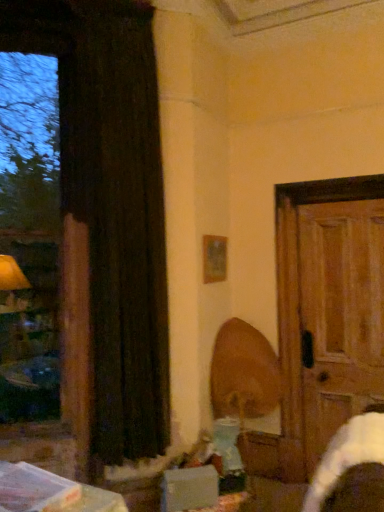
The height and width of the screenshot is (512, 384). I want to click on empty space that is ontop of wooden door at right (from a real-world perspective), so click(335, 178).